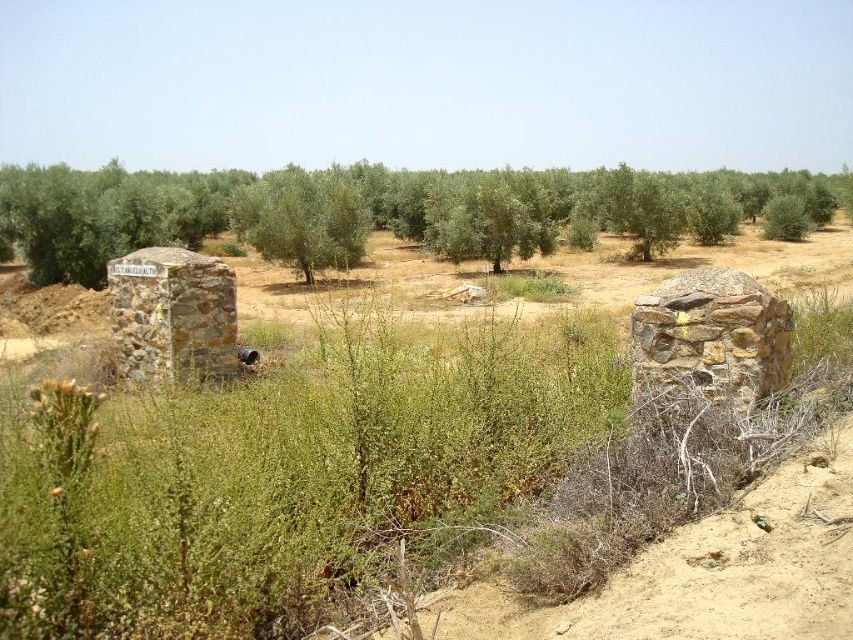
Which is below, green leafy tree at left or green leafy tree at center?

green leafy tree at center is lower down.

Is green leafy tree at left taller than green leafy tree at center?

Yes, green leafy tree at left is taller than green leafy tree at center.

In order to click on green leafy tree at left in this screenshot , I will do `click(384, 211)`.

Is green leafy tree at left wider than brown rough stone at center?

Yes.

Is point (428, 179) more distant than point (784, 321)?

Yes, point (428, 179) is farther from viewer.

Which is behind, point (618, 227) or point (643, 342)?

Point (618, 227)

The height and width of the screenshot is (640, 853). Find the location of `green leafy tree at left`. green leafy tree at left is located at coordinates click(384, 211).

Does brown rough stone at center have a lesser height compared to green leafy tree at center?

Indeed, brown rough stone at center has a lesser height compared to green leafy tree at center.

The height and width of the screenshot is (640, 853). Identify the location of brown rough stone at center. (712, 337).